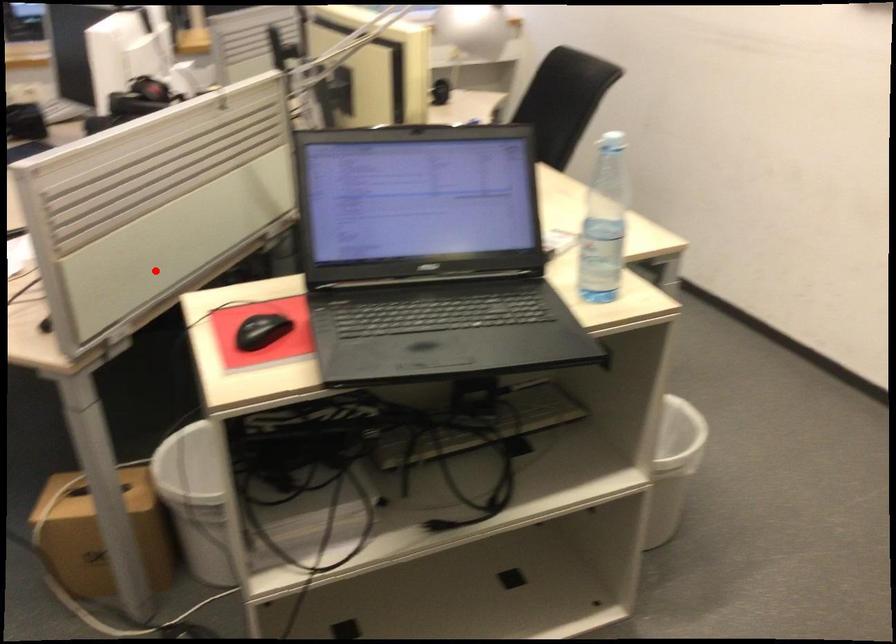
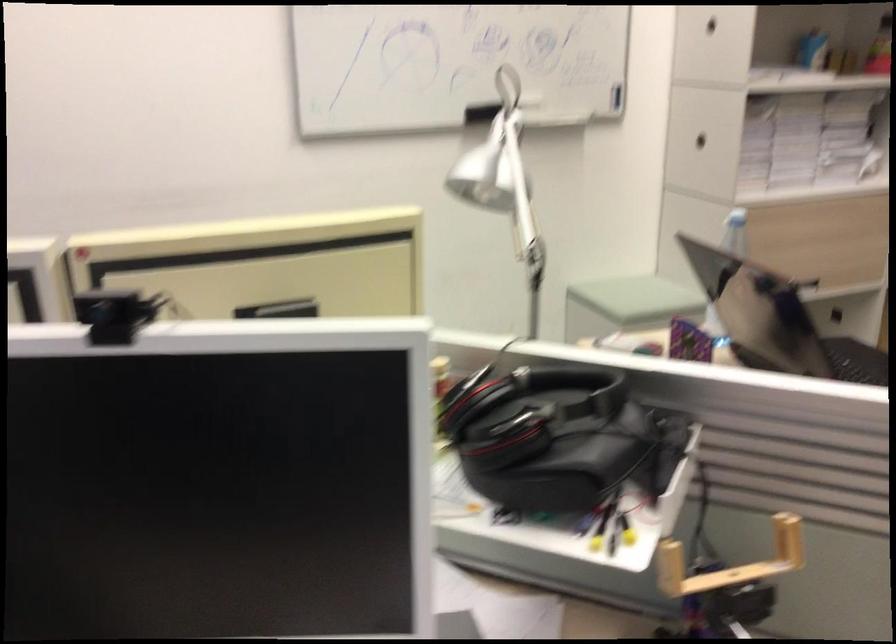
Question: I am providing you with two images of the same scene from different viewpoints. Image1 has a red point marked. In image2, the corresponding 3D location appears at what relative position? Reply with the corresponding letter.

Choices:
 (A) Closer
 (B) Farther

Answer: (A)